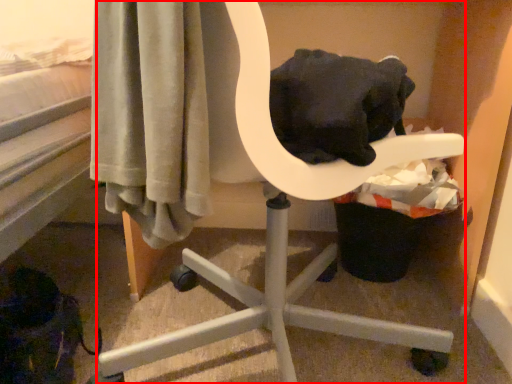
Question: From the image's perspective, considering the relative positions of chair (annotated by the red box) and laundry basket in the image provided, where is chair (annotated by the red box) located with respect to the staircase?

Choices:
 (A) below
 (B) above

Answer: (B)